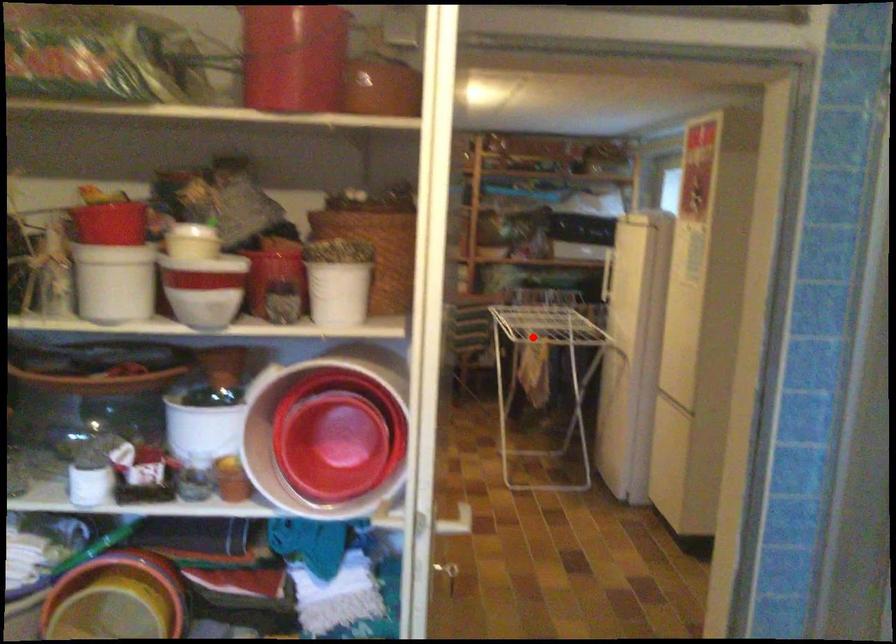
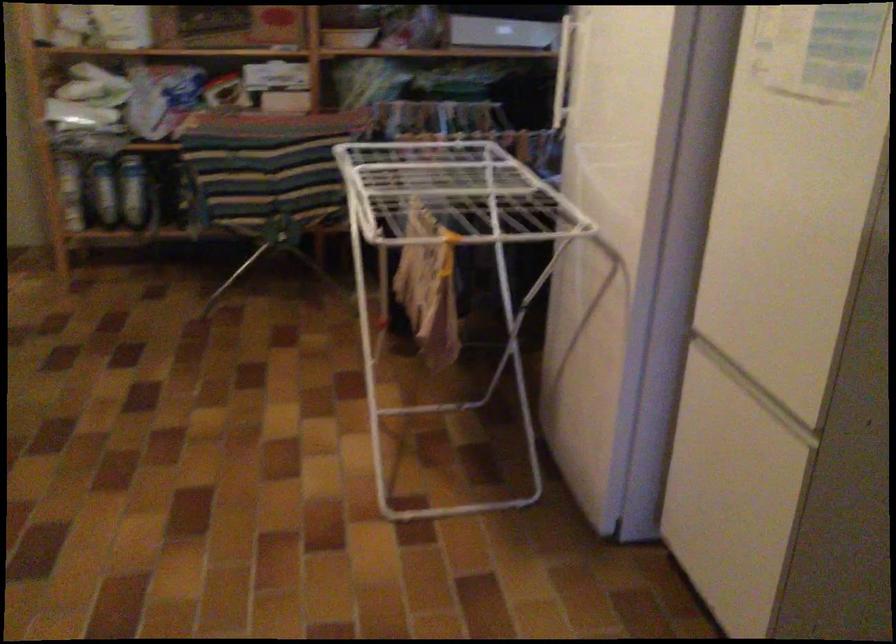
Question: I am providing you with two images of the same scene from different viewpoints. A red point is marked on the first image. Is the red point's position out of view in image 2?

Choices:
 (A) Yes
 (B) No

Answer: (B)